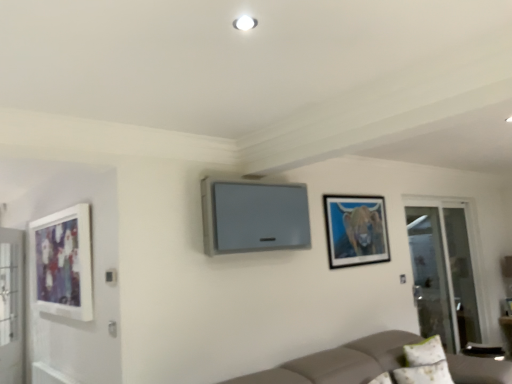
Question: Is white fabric pillow at lower right turned away from matte black picture frame at upper right, marked as the first picture frame in a right-to-left arrangement?

Choices:
 (A) yes
 (B) no

Answer: (B)

Question: Does white fabric pillow at lower right turn towards matte black picture frame at upper right, which is the second picture frame in left-to-right order?

Choices:
 (A) yes
 (B) no

Answer: (B)

Question: From a real-world perspective, is white fabric pillow at lower right beneath matte black picture frame at upper right, marked as the first picture frame in a right-to-left arrangement?

Choices:
 (A) yes
 (B) no

Answer: (A)

Question: Considering the relative sizes of white fabric pillow at lower right and matte black picture frame at upper right, which is the second picture frame in left-to-right order, in the image provided, is white fabric pillow at lower right thinner than matte black picture frame at upper right, which is the second picture frame in left-to-right order,?

Choices:
 (A) yes
 (B) no

Answer: (B)

Question: Is white fabric pillow at lower right not close to matte black picture frame at upper right, which is the second picture frame in left-to-right order?

Choices:
 (A) no
 (B) yes

Answer: (B)

Question: From the image's perspective, is white fabric pillow at lower right beneath matte black picture frame at upper right, which is the second picture frame in left-to-right order?

Choices:
 (A) no
 (B) yes

Answer: (B)

Question: Considering the relative sizes of matte black picture frame at upper right, which is the second picture frame in left-to-right order, and white fabric pillow at lower right in the image provided, is matte black picture frame at upper right, which is the second picture frame in left-to-right order, wider than white fabric pillow at lower right?

Choices:
 (A) yes
 (B) no

Answer: (B)

Question: Considering the relative sizes of matte black picture frame at upper right, marked as the first picture frame in a right-to-left arrangement, and white fabric pillow at lower right in the image provided, is matte black picture frame at upper right, marked as the first picture frame in a right-to-left arrangement, thinner than white fabric pillow at lower right?

Choices:
 (A) yes
 (B) no

Answer: (A)

Question: Considering the relative sizes of matte black picture frame at upper right, marked as the first picture frame in a right-to-left arrangement, and white fabric pillow at lower right in the image provided, is matte black picture frame at upper right, marked as the first picture frame in a right-to-left arrangement, taller than white fabric pillow at lower right?

Choices:
 (A) yes
 (B) no

Answer: (A)

Question: Does matte black picture frame at upper right, marked as the first picture frame in a right-to-left arrangement, contain white fabric pillow at lower right?

Choices:
 (A) yes
 (B) no

Answer: (B)

Question: Is matte black picture frame at upper right, which is the second picture frame in left-to-right order, far from white fabric pillow at lower right?

Choices:
 (A) no
 (B) yes

Answer: (B)

Question: Considering the relative sizes of matte black picture frame at upper right, which is the second picture frame in left-to-right order, and white fabric pillow at lower right in the image provided, is matte black picture frame at upper right, which is the second picture frame in left-to-right order, smaller than white fabric pillow at lower right?

Choices:
 (A) yes
 (B) no

Answer: (A)

Question: Does matte white picture frame at left, which is the 1th picture frame in left-to-right order, come in front of white fabric pillow at lower right?

Choices:
 (A) yes
 (B) no

Answer: (A)